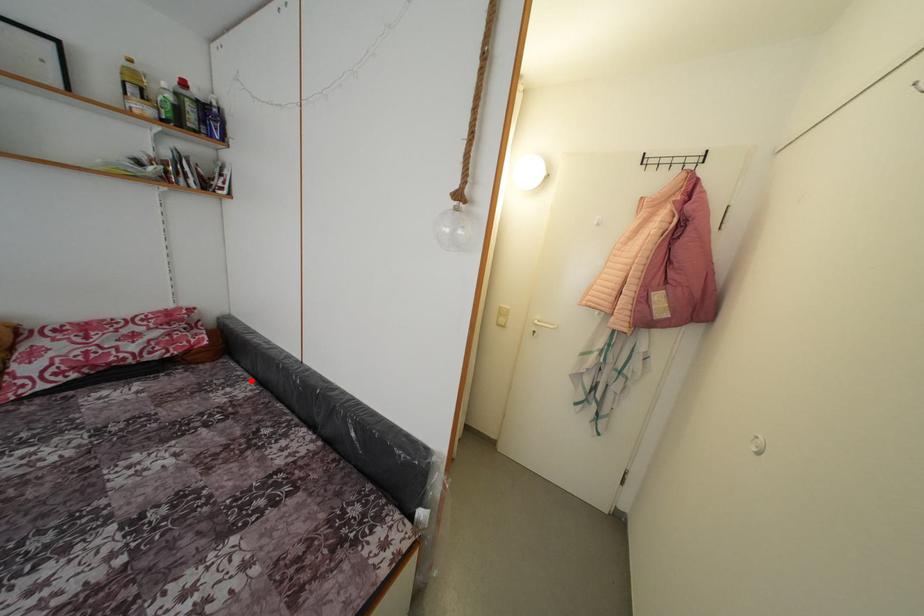
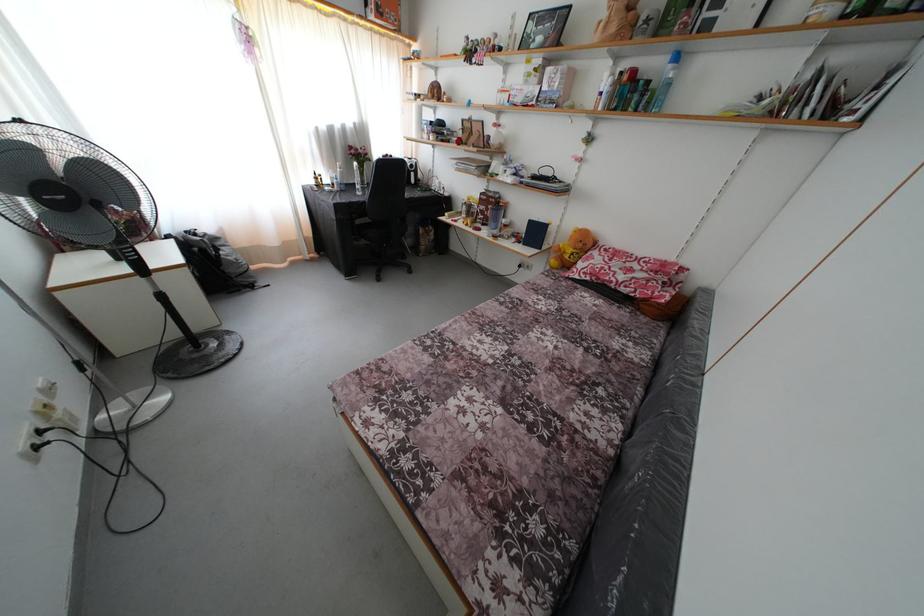
Find the pixel in the second image that matches the highlighted location in the first image.

(663, 353)